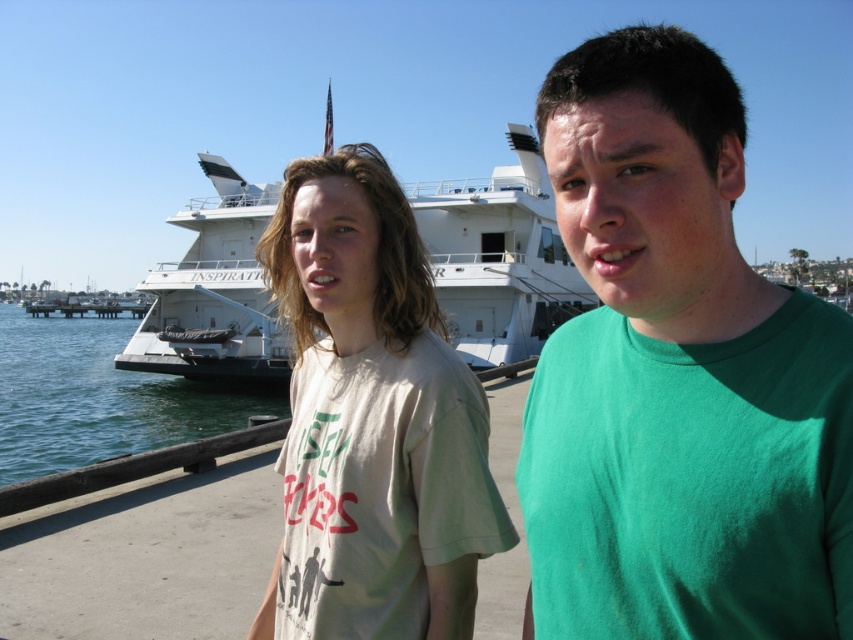
Can you confirm if white glossy yacht at upper center is bigger than clear blue water at lower left?

Incorrect, white glossy yacht at upper center is not larger than clear blue water at lower left.

Identify the location of white glossy yacht at upper center. (498, 257).

Between point (289, 396) and point (167, 404), which one is positioned in front?

Point (289, 396) is more forward.

Between light beige t-shirt at center and clear blue water at lower left, which one appears on the right side from the viewer's perspective?

Positioned to the right is light beige t-shirt at center.

Between point (502, 545) and point (7, 305), which one is positioned in front?

Positioned in front is point (502, 545).

Image resolution: width=853 pixels, height=640 pixels. Identify the location of light beige t-shirt at center. (372, 420).

Is light beige t-shirt at center bigger than white glossy yacht at upper center?

No.

Is point (339, 259) farther from camera compared to point (509, 260)?

No.

What do you see at coordinates (372, 420) in the screenshot? I see `light beige t-shirt at center` at bounding box center [372, 420].

Identify the location of light beige t-shirt at center. (372, 420).